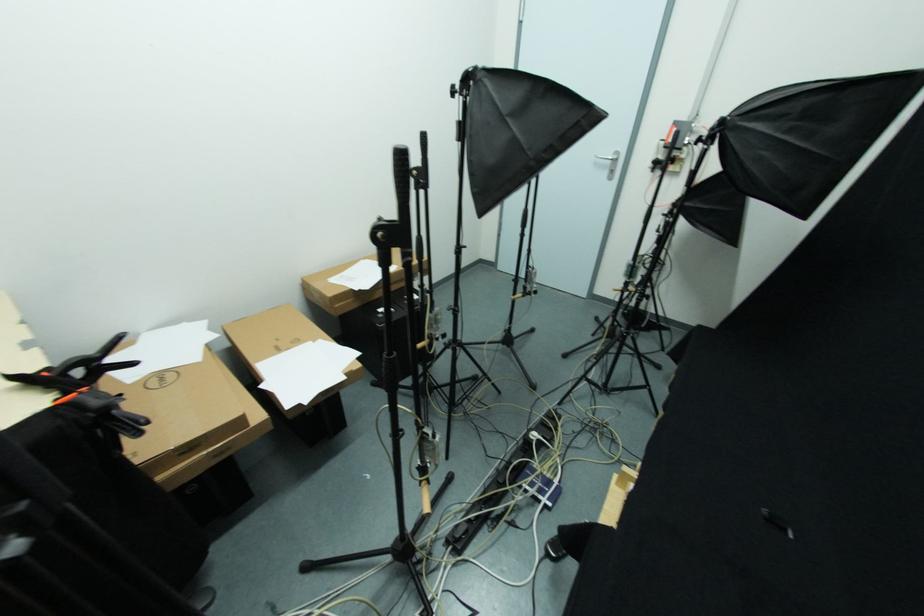
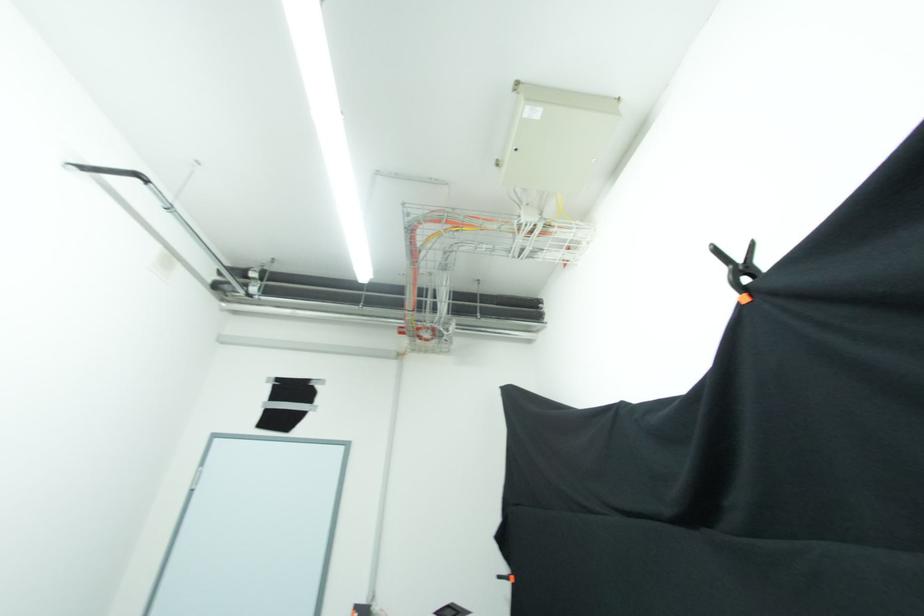
First-person continuous shooting, in which direction is the camera rotating?

The camera's rotation is toward right-up.